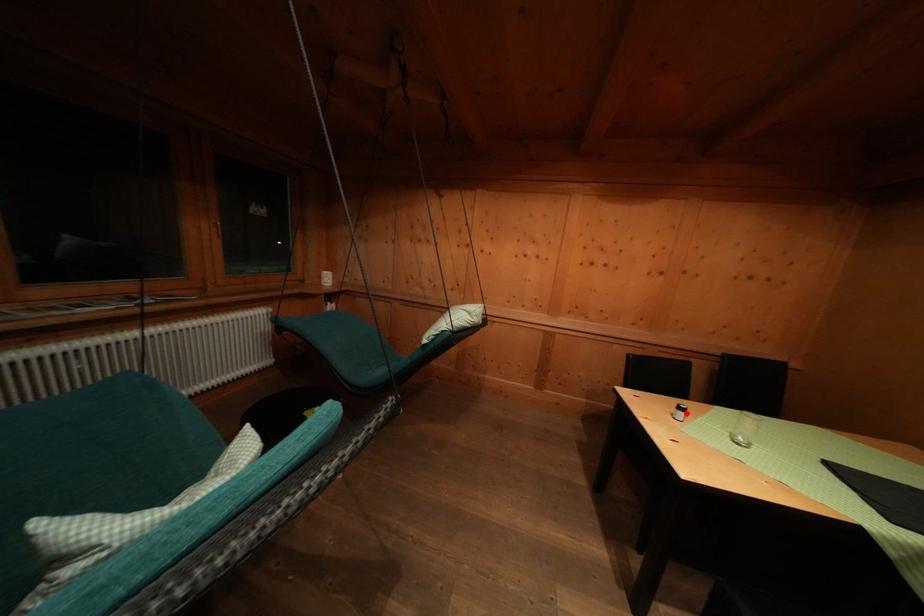
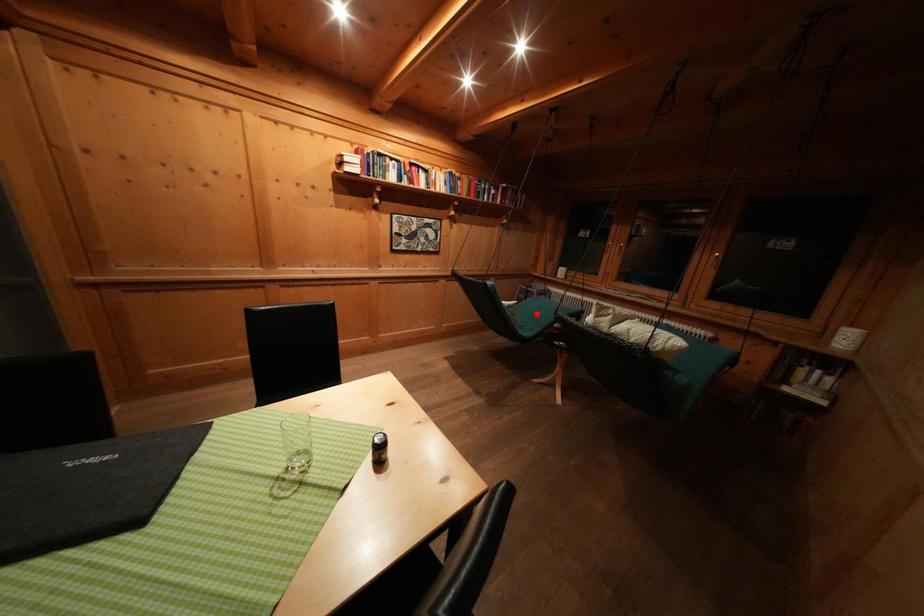
I am providing you with two images of the same scene from different viewpoints. A red point is marked on the first image and another point is marked on the second image. Do the highlighted points in image1 and image2 indicate the same real-world spot?

No